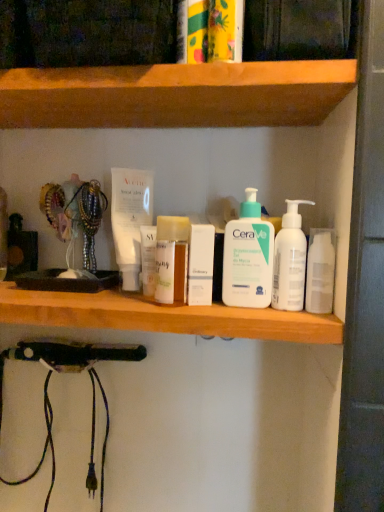
Where is `blank area to the left of white glossy mouthwash at right`? blank area to the left of white glossy mouthwash at right is located at coordinates (206, 307).